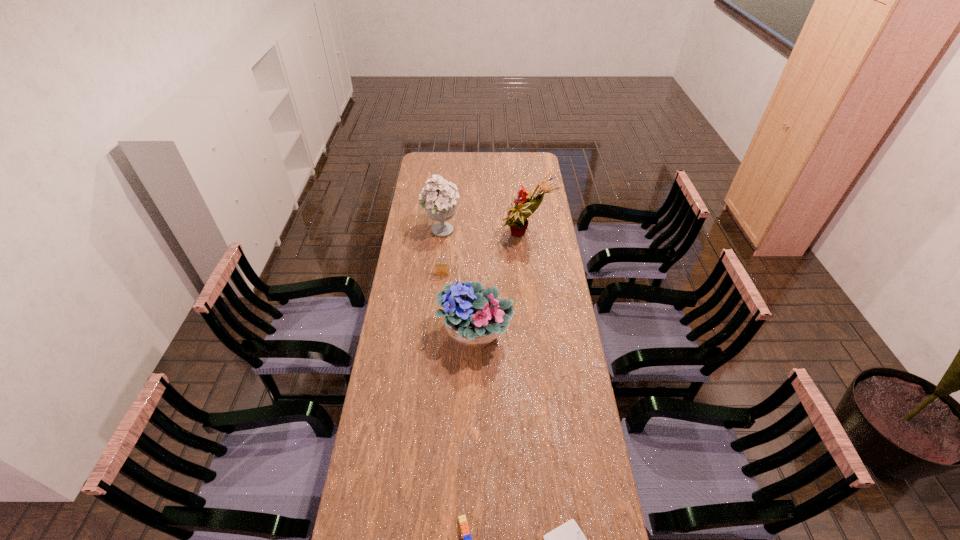
In the image, there is a desktop. Identify the location of free space at the right edge. The image size is (960, 540). (582, 439).

You are a GUI agent. You are given a task and a screenshot of the screen. Output one action in this format:
    pyautogui.click(x=<x>, y=<y>)
    Task: Click on the vacant space at the far left corner
    The width and height of the screenshot is (960, 540).
    Given the screenshot: What is the action you would take?
    pyautogui.click(x=420, y=163)

Where is `vacant space at the far right corner`? The width and height of the screenshot is (960, 540). vacant space at the far right corner is located at coordinates (535, 170).

Identify which object is the third closest to the Lego. Please provide its 2D coordinates. Your answer should be formatted as a tuple, i.e. [(x, y)], where the tuple contains the x and y coordinates of a point satisfying the conditions above.

[(441, 269)]

Identify which object is located as the nearest to the Lego. Please provide its 2D coordinates. Your answer should be formatted as a tuple, i.e. [(x, y)], where the tuple contains the x and y coordinates of a point satisfying the conditions above.

[(567, 539)]

Identify which bouquet is the nearest to the padlock. Please provide its 2D coordinates. Your answer should be formatted as a tuple, i.e. [(x, y)], where the tuple contains the x and y coordinates of a point satisfying the conditions above.

[(473, 319)]

Select which bouquet appears as the second closest to the diary. Please provide its 2D coordinates. Your answer should be formatted as a tuple, i.e. [(x, y)], where the tuple contains the x and y coordinates of a point satisfying the conditions above.

[(516, 219)]

In order to click on vacant region that satisfies the following two spatial constraints: 1. on the front-facing side of the nearest bouquet; 2. on the left side of the padlock in this screenshot , I will do `click(438, 334)`.